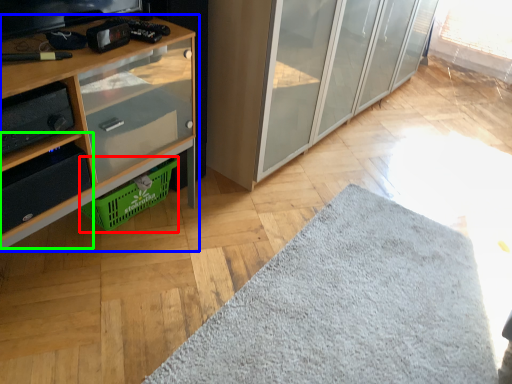
Question: Considering the real-world distances, which object is closest to basket (highlighted by a red box)? cupboard (highlighted by a blue box) or shelf (highlighted by a green box).

Choices:
 (A) cupboard
 (B) shelf

Answer: (A)